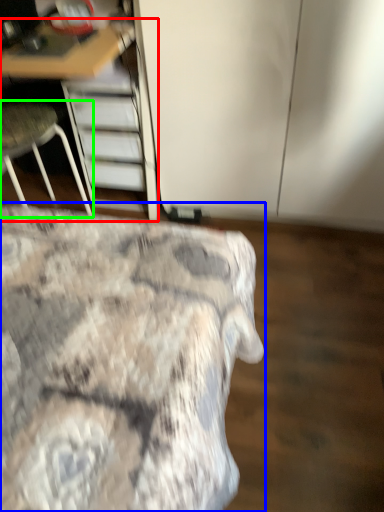
Question: Estimate the real-world distances between objects in this image. Which object is closer to furniture (highlighted by a red box), bed (highlighted by a blue box) or chair (highlighted by a green box)?

Choices:
 (A) bed
 (B) chair

Answer: (B)